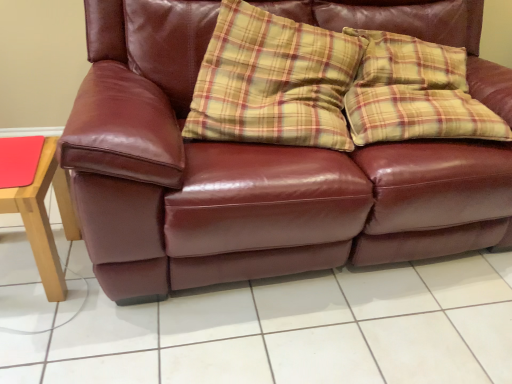
What do you see at coordinates (247, 176) in the screenshot?
I see `burgundy leather couch at center` at bounding box center [247, 176].

What do you see at coordinates (287, 329) in the screenshot? I see `matte leather couch at center` at bounding box center [287, 329].

Locate an element on the screen. The width and height of the screenshot is (512, 384). burgundy leather couch at center is located at coordinates (247, 176).

From a real-world perspective, which is physically below, burgundy leather couch at center or matte wood table at left?

matte wood table at left.

Does burgundy leather couch at center have a larger size compared to matte wood table at left?

Correct, burgundy leather couch at center is larger in size than matte wood table at left.

Is burgundy leather couch at center oriented towards matte wood table at left?

No, burgundy leather couch at center is not turned towards matte wood table at left.

Which object is closer to the camera taking this photo, matte wood table at left or matte leather couch at center?

matte leather couch at center is closer to the camera.

Locate an element on the screen. The image size is (512, 384). table on the left side of matte leather couch at center is located at coordinates (45, 217).

Can you confirm if matte wood table at left is taller than matte leather couch at center?

Yes.

Is matte wood table at left positioned beyond the bounds of matte leather couch at center?

matte wood table at left is positioned outside matte leather couch at center.

Considering the sizes of matte leather couch at center and matte wood table at left in the image, is matte leather couch at center wider or thinner than matte wood table at left?

matte leather couch at center is wider than matte wood table at left.

How different are the orientations of matte leather couch at center and matte wood table at left in degrees?

matte leather couch at center and matte wood table at left are facing 1.26 degrees away from each other.

Would you say matte leather couch at center is to the left or to the right of matte wood table at left in the picture?

From the image, it's evident that matte leather couch at center is to the right of matte wood table at left.

Considering the positions of point (225, 376) and point (57, 191), is point (225, 376) closer or farther from the camera than point (57, 191)?

Point (225, 376) appears to be closer to the viewer than point (57, 191).

Considering the points (499, 104) and (7, 352), which point is in front, point (499, 104) or point (7, 352)?

The point (7, 352) is closer.

Is burgundy leather couch at center wider or thinner than matte leather couch at center?

Clearly, burgundy leather couch at center has more width compared to matte leather couch at center.

Which of these two, burgundy leather couch at center or matte leather couch at center, stands taller?

With more height is burgundy leather couch at center.

From the image's perspective, does burgundy leather couch at center appear higher than matte leather couch at center?

Indeed, from the image's perspective, burgundy leather couch at center is shown above matte leather couch at center.

Would you say matte leather couch at center is a long distance from burgundy leather couch at center?

matte leather couch at center is actually quite close to burgundy leather couch at center.

Does matte leather couch at center have a lesser width compared to burgundy leather couch at center?

Yes.

Which is behind, matte leather couch at center or burgundy leather couch at center?

matte leather couch at center is more distant.

Looking at this image, from a real-world perspective, between matte leather couch at center and burgundy leather couch at center, who is vertically lower?

matte leather couch at center is physically lower.

Considering the relative positions of matte wood table at left and burgundy leather couch at center in the image provided, is matte wood table at left to the left or to the right of burgundy leather couch at center?

Based on their positions, matte wood table at left is located to the left of burgundy leather couch at center.

Considering the points (47, 139) and (178, 60), which point is in front, point (47, 139) or point (178, 60)?

Positioned in front is point (47, 139).

Considering the relative sizes of matte wood table at left and burgundy leather couch at center in the image provided, is matte wood table at left thinner than burgundy leather couch at center?

Correct, the width of matte wood table at left is less than that of burgundy leather couch at center.

Does matte wood table at left have a larger size compared to burgundy leather couch at center?

No, matte wood table at left is not bigger than burgundy leather couch at center.

Where is `table below the burgundy leather couch at center (from a real-world perspective)`? The width and height of the screenshot is (512, 384). table below the burgundy leather couch at center (from a real-world perspective) is located at coordinates (45, 217).

Where is `tile on the right side of matte wood table at left`? tile on the right side of matte wood table at left is located at coordinates (287, 329).

Which object lies further to the anchor point burgundy leather couch at center, matte wood table at left or matte leather couch at center?

matte wood table at left.

When comparing their distances from burgundy leather couch at center, does matte leather couch at center or matte wood table at left seem closer?

The object closer to burgundy leather couch at center is matte leather couch at center.

Estimate the real-world distances between objects in this image. Which object is further from matte leather couch at center, matte wood table at left or burgundy leather couch at center?

Among the two, matte wood table at left is located further to matte leather couch at center.

Considering their positions, is matte leather couch at center positioned further to matte wood table at left than burgundy leather couch at center?

The object further to matte wood table at left is burgundy leather couch at center.

Considering their positions, is burgundy leather couch at center positioned closer to matte wood table at left than matte leather couch at center?

Based on the image, matte leather couch at center appears to be nearer to matte wood table at left.

Which object lies nearer to the anchor point matte leather couch at center, burgundy leather couch at center or matte wood table at left?

burgundy leather couch at center is positioned closer to the anchor matte leather couch at center.

Find the location of a particular element. tile situated between matte wood table at left and burgundy leather couch at center from left to right is located at coordinates (287, 329).